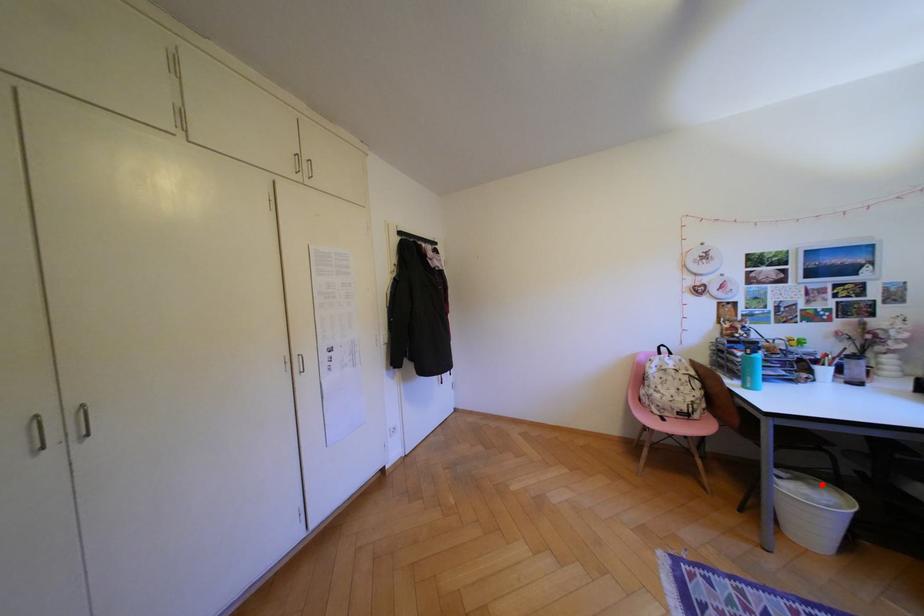
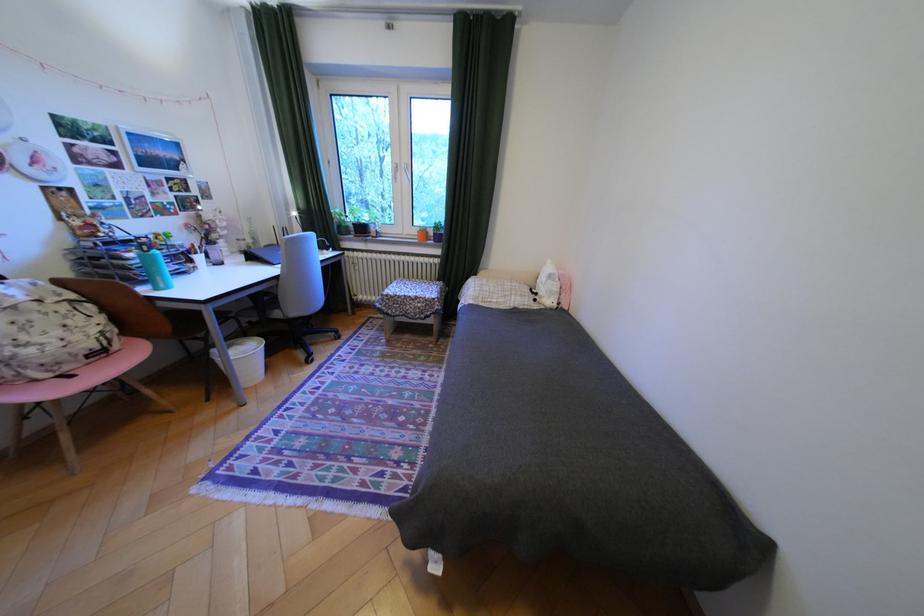
Question: A red point is marked in image1. In image2, is the corresponding 3D point closer to the camera or farther? Reply with the corresponding letter.

Choices:
 (A) The corresponding 3D point is closer.
 (B) The corresponding 3D point is farther.

Answer: (A)